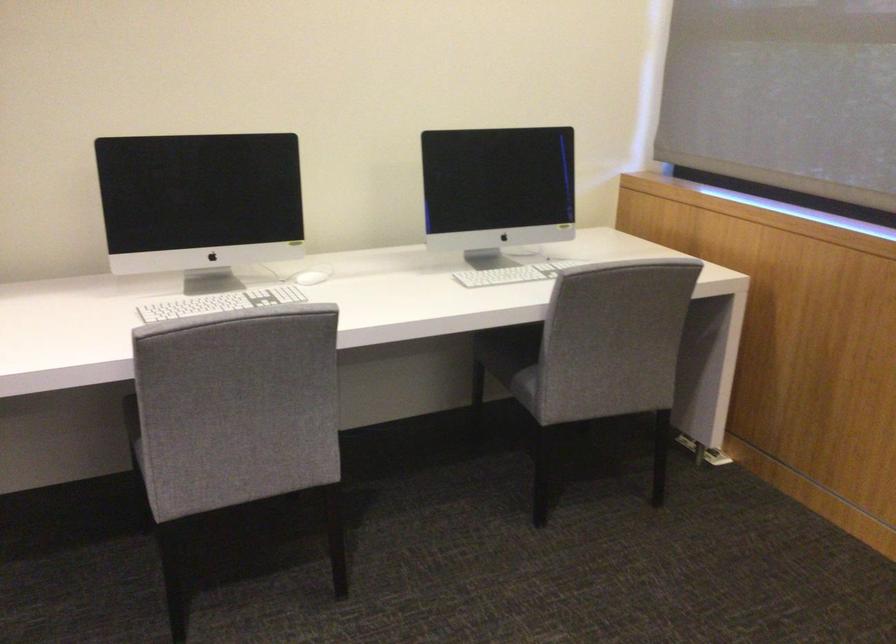
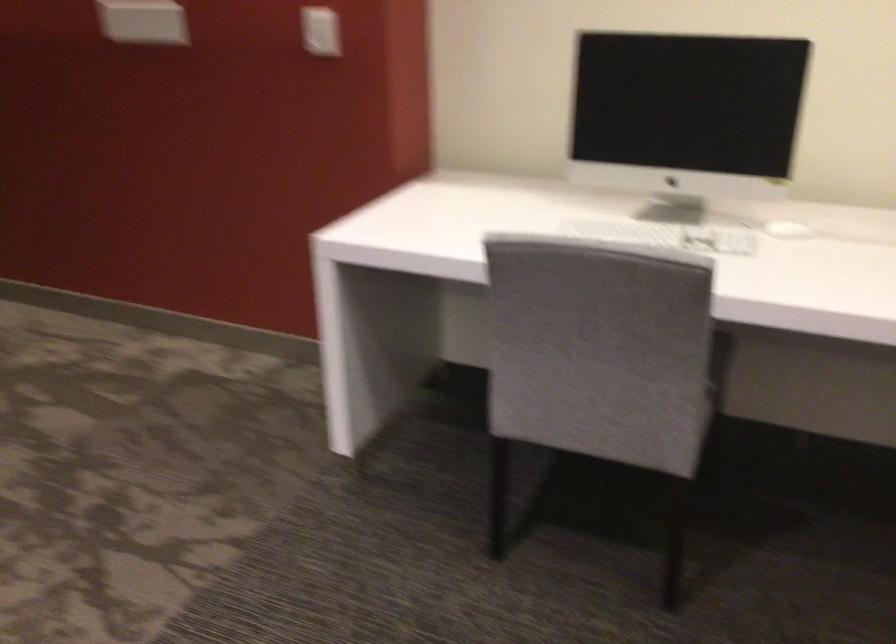
Question: How did the camera likely rotate?

Choices:
 (A) Left
 (B) Right
 (C) Up
 (D) Down

Answer: (A)